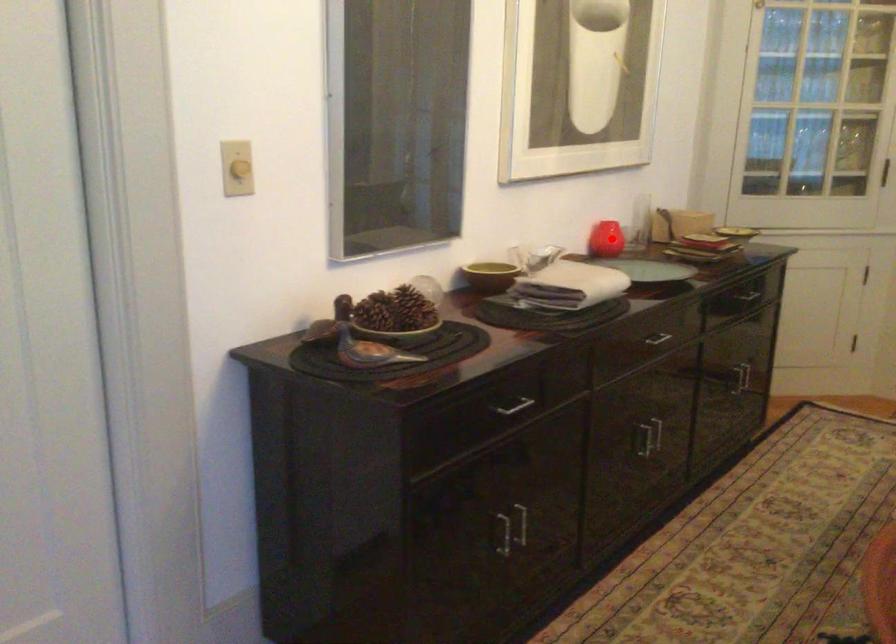
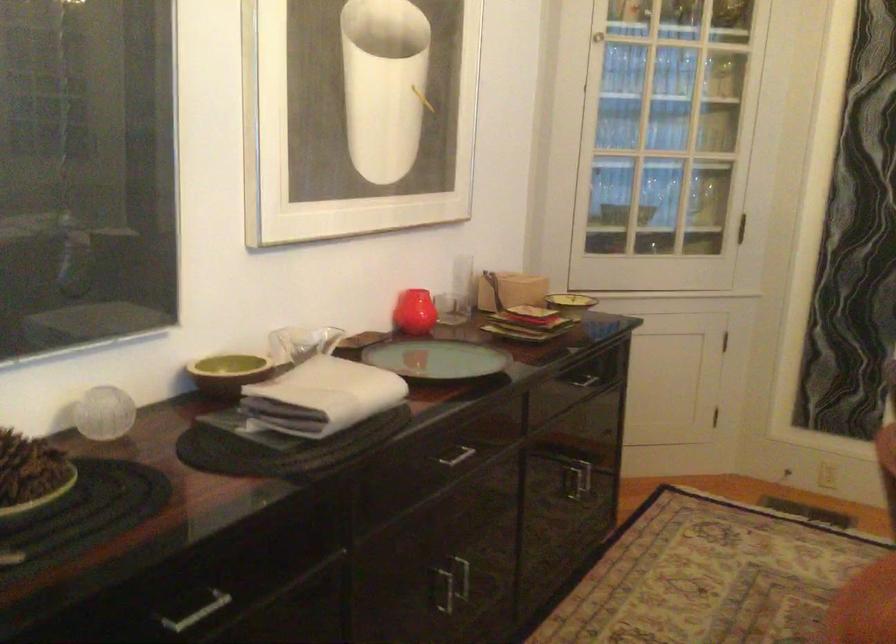
Question: I am providing you with two images of the same scene from different viewpoints. Image1 has a red point marked. In image2, the corresponding 3D location appears at what relative position? Reply with the corresponding letter.

Choices:
 (A) Closer
 (B) Farther

Answer: (A)